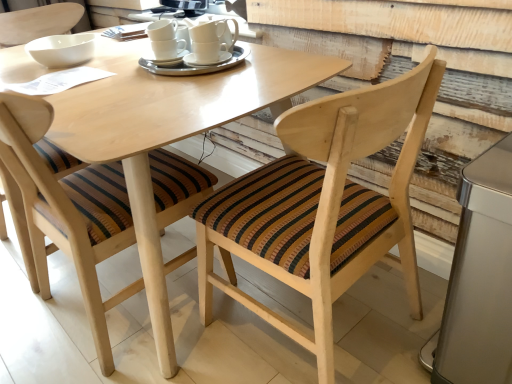
What is the approximate width of white ceramic cups at center, positioned as the 1th tableware in right-to-left order?

It is 13.12 inches.

This screenshot has height=384, width=512. I want to click on white ceramic cups at center, the second tableware viewed from the right, so click(x=165, y=40).

What do you see at coordinates (206, 61) in the screenshot? I see `white ceramic saucer at center` at bounding box center [206, 61].

This screenshot has width=512, height=384. Identify the location of wooden chair with striped cushion at center, the 2th chair viewed from the left. (322, 206).

Is white ceramic cups at center, the second tableware viewed from the right, directly adjacent to wooden chair with striped cushion at center, which appears as the first chair when viewed from the left?

white ceramic cups at center, the second tableware viewed from the right, and wooden chair with striped cushion at center, which appears as the first chair when viewed from the left, are not in contact.

Is white ceramic cups at center, acting as the first tableware starting from the left, facing towards wooden chair with striped cushion at center, which appears as the first chair when viewed from the left?

Yes.

From the image's perspective, is white ceramic cups at center, the second tableware viewed from the right, located beneath wooden chair with striped cushion at center, the 2th chair from the right?

Incorrect, from the image's perspective, white ceramic cups at center, the second tableware viewed from the right, is higher than wooden chair with striped cushion at center, the 2th chair from the right.

Who is shorter, white ceramic cups at center, acting as the first tableware starting from the left, or wooden chair with striped cushion at center, the 2th chair from the right?

Standing shorter between the two is white ceramic cups at center, acting as the first tableware starting from the left.

The width and height of the screenshot is (512, 384). In order to click on chair below the wooden chair with striped cushion at center, the 2th chair viewed from the left (from a real-world perspective) in this screenshot , I will do `click(68, 208)`.

Consider the image. From the image's perspective, is wooden chair with striped cushion at center, which is the first chair from right to left, positioned above or below wooden chair with striped cushion at center, which appears as the first chair when viewed from the left?

Based on their image positions, wooden chair with striped cushion at center, which is the first chair from right to left, is located beneath wooden chair with striped cushion at center, which appears as the first chair when viewed from the left.

Which is behind, point (203, 233) or point (160, 195)?

Positioned behind is point (160, 195).

Based on the photo, would you say white ceramic cup at center contains white ceramic cups at center, positioned as the 1th tableware in right-to-left order?

Actually, white ceramic cups at center, positioned as the 1th tableware in right-to-left order, is outside white ceramic cup at center.

In order to click on coffee cup located above the white ceramic cups at center, positioned as the 1th tableware in right-to-left order (from the image's perspective) in this screenshot , I will do `click(214, 33)`.

What's the angular difference between white ceramic cup at center and white ceramic cups at center, positioned as the 1th tableware in right-to-left order,'s facing directions?

There is a 4.37-degree angle between the facing directions of white ceramic cup at center and white ceramic cups at center, positioned as the 1th tableware in right-to-left order.

Is white ceramic cup at center looking in the opposite direction of white ceramic cups at center, positioned as the 1th tableware in right-to-left order?

No, white ceramic cups at center, positioned as the 1th tableware in right-to-left order, is not at the back of white ceramic cup at center.

Considering the sizes of white ceramic cup at center and white ceramic saucer at center in the image, is white ceramic cup at center taller or shorter than white ceramic saucer at center?

In the image, white ceramic cup at center appears to be taller than white ceramic saucer at center.

Between point (224, 26) and point (226, 52), which one is positioned behind?

The point (224, 26) is farther.

Does white ceramic cup at center come behind white ceramic saucer at center?

No, it is not.

From a real-world perspective, is white ceramic cups at center, positioned as the 1th tableware in right-to-left order, under white ceramic saucer at center?

Yes.

The image size is (512, 384). What are the coordinates of `saucer below the white ceramic cups at center, which ranks as the 2th tableware in left-to-right order (from the image's perspective)` in the screenshot? It's located at (206, 61).

From the image's perspective, is white ceramic cups at center, which ranks as the 2th tableware in left-to-right order, above white ceramic saucer at center?

Yes, from the image's perspective, white ceramic cups at center, which ranks as the 2th tableware in left-to-right order, is over white ceramic saucer at center.

Would you say silver metallic trash can at lower right is inside or outside white ceramic cup at center?

silver metallic trash can at lower right lies outside white ceramic cup at center.

Is silver metallic trash can at lower right wider or thinner than white ceramic cup at center?

Considering their sizes, silver metallic trash can at lower right looks broader than white ceramic cup at center.

Is silver metallic trash can at lower right beside white ceramic cup at center?

silver metallic trash can at lower right is not next to white ceramic cup at center, and they're not touching.

Find the location of a particular element. The width and height of the screenshot is (512, 384). coffee cup lying on the left of silver metallic trash can at lower right is located at coordinates (214, 33).

From the image's perspective, is wooden chair with striped cushion at center, the 2th chair from the right, over silver metallic trash can at lower right?

Yes, from the image's perspective, wooden chair with striped cushion at center, the 2th chair from the right, is above silver metallic trash can at lower right.

Based on the photo, does wooden chair with striped cushion at center, the 2th chair from the right, lie behind silver metallic trash can at lower right?

Yes, it is.

In the scene shown: Can you confirm if wooden chair with striped cushion at center, the 2th chair from the right, is positioned to the left of silver metallic trash can at lower right?

Yes.

Who is smaller, wooden chair with striped cushion at center, the 2th chair from the right, or silver metallic trash can at lower right?

silver metallic trash can at lower right.

You are a GUI agent. You are given a task and a screenshot of the screen. Output one action in this format:
    pyautogui.click(x=<x>, y=<y>)
    Task: Click on the 1st chair positioned below the white ceramic cups at center, acting as the first tableware starting from the left (from the image's perspective)
    
    Given the screenshot: What is the action you would take?
    point(68,208)

Find the location of `chair that appears on the right of wooden chair with striped cushion at center, the 2th chair from the right`. chair that appears on the right of wooden chair with striped cushion at center, the 2th chair from the right is located at coordinates (322, 206).

Consider the image. Estimate the real-world distances between objects in this image. Which object is closer to wooden chair with striped cushion at center, the 2th chair viewed from the left, wooden chair with striped cushion at center, which appears as the first chair when viewed from the left, or white ceramic cups at center, the second tableware viewed from the right?

The object closer to wooden chair with striped cushion at center, the 2th chair viewed from the left, is wooden chair with striped cushion at center, which appears as the first chair when viewed from the left.

Looking at this image, which object lies nearer to the anchor point white ceramic saucer at center, wooden chair with striped cushion at center, which appears as the first chair when viewed from the left, or silver metallic trash can at lower right?

wooden chair with striped cushion at center, which appears as the first chair when viewed from the left, is positioned closer to the anchor white ceramic saucer at center.

Looking at the image, which one is located closer to white ceramic cups at center, which ranks as the 2th tableware in left-to-right order, white ceramic cups at center, acting as the first tableware starting from the left, or silver metallic trash can at lower right?

The object closer to white ceramic cups at center, which ranks as the 2th tableware in left-to-right order, is white ceramic cups at center, acting as the first tableware starting from the left.

Considering their positions, is wooden chair with striped cushion at center, which appears as the first chair when viewed from the left, positioned closer to white ceramic saucer at center than white ceramic cups at center, which ranks as the 2th tableware in left-to-right order?

white ceramic cups at center, which ranks as the 2th tableware in left-to-right order, is closer to white ceramic saucer at center.

Based on their spatial positions, is white ceramic saucer at center or wooden chair with striped cushion at center, which is the first chair from right to left, closer to white ceramic cup at center?

Among the two, white ceramic saucer at center is located nearer to white ceramic cup at center.

Looking at the image, which one is located closer to white ceramic cups at center, the second tableware viewed from the right, white ceramic cup at center or white ceramic cups at center, positioned as the 1th tableware in right-to-left order?

white ceramic cups at center, positioned as the 1th tableware in right-to-left order, is positioned closer to the anchor white ceramic cups at center, the second tableware viewed from the right.

From the image, which object appears to be farther from wooden chair with striped cushion at center, which appears as the first chair when viewed from the left, white ceramic saucer at center or white ceramic cups at center, which ranks as the 2th tableware in left-to-right order?

Among the two, white ceramic saucer at center is located further to wooden chair with striped cushion at center, which appears as the first chair when viewed from the left.

When comparing their distances from white ceramic cups at center, positioned as the 1th tableware in right-to-left order, does silver metallic trash can at lower right or wooden chair with striped cushion at center, which is the first chair from right to left, seem further?

The object further to white ceramic cups at center, positioned as the 1th tableware in right-to-left order, is silver metallic trash can at lower right.

The height and width of the screenshot is (384, 512). Find the location of `tableware between white ceramic cup at center and wooden chair with striped cushion at center, the 2th chair from the right, from top to bottom`. tableware between white ceramic cup at center and wooden chair with striped cushion at center, the 2th chair from the right, from top to bottom is located at coordinates (196, 66).

Where is `chair located between white ceramic saucer at center and silver metallic trash can at lower right in the left-right direction`? This screenshot has width=512, height=384. chair located between white ceramic saucer at center and silver metallic trash can at lower right in the left-right direction is located at coordinates (322, 206).

You are a GUI agent. You are given a task and a screenshot of the screen. Output one action in this format:
    pyautogui.click(x=<x>, y=<y>)
    Task: Click on the chair between white ceramic cups at center, acting as the first tableware starting from the left, and silver metallic trash can at lower right from left to right
    The image size is (512, 384).
    Given the screenshot: What is the action you would take?
    pyautogui.click(x=322, y=206)

Where is `saucer between white ceramic cups at center, acting as the first tableware starting from the left, and silver metallic trash can at lower right from left to right`? saucer between white ceramic cups at center, acting as the first tableware starting from the left, and silver metallic trash can at lower right from left to right is located at coordinates (206, 61).